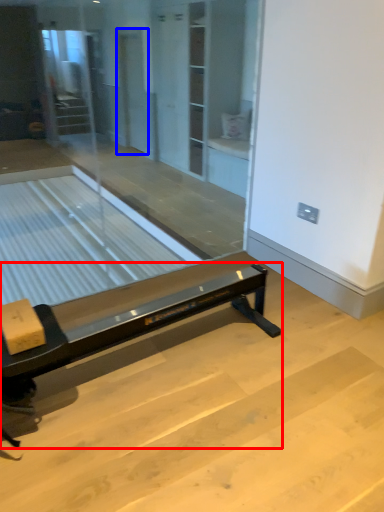
Question: Which of the following is the farthest to the observer, furniture (highlighted by a red box) or screen door (highlighted by a blue box)?

Choices:
 (A) furniture
 (B) screen door

Answer: (B)